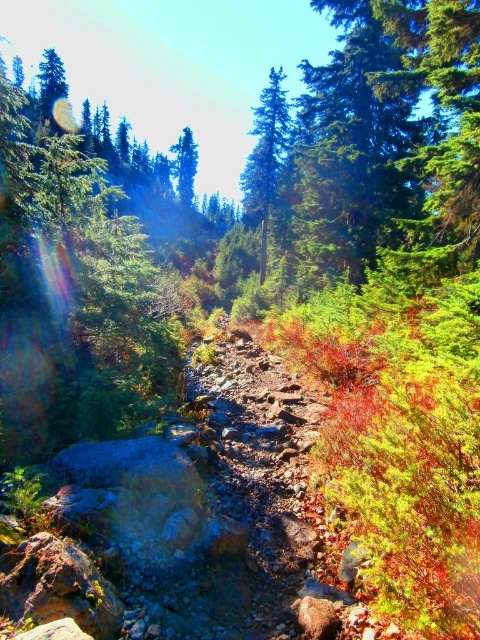
You are a hiker standing on the rocky trail in the forest. You see the green matte tree at center and the green matte tree at upper center. Which tree is shorter?

The green matte tree at center is shorter than the green matte tree at upper center.